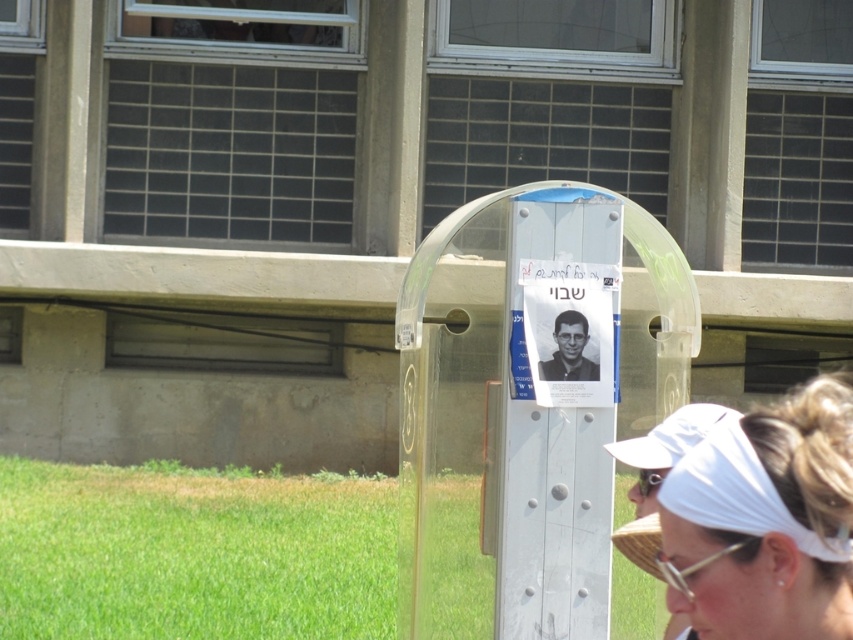
Can you confirm if white fabric headband at lower right is positioned above clear plastic goggles at center?

Yes, white fabric headband at lower right is above clear plastic goggles at center.

Is point (833, 403) closer to camera compared to point (660, 554)?

Yes.

In order to click on white fabric headband at lower right in this screenshot , I will do `click(767, 522)`.

Is white fabric headband at lower right behind black matte photo frame at center?

No, it is in front of black matte photo frame at center.

Which is behind, point (761, 608) or point (595, 378)?

Point (595, 378)

Identify the location of white fabric headband at lower right. The image size is (853, 640). (767, 522).

Locate an element on the screen. This screenshot has height=640, width=853. white fabric headband at lower right is located at coordinates (767, 522).

Does green grass at lower left have a lesser width compared to black matte photo frame at center?

No.

This screenshot has height=640, width=853. What do you see at coordinates (193, 554) in the screenshot?
I see `green grass at lower left` at bounding box center [193, 554].

Locate an element on the screen. Image resolution: width=853 pixels, height=640 pixels. green grass at lower left is located at coordinates (193, 554).